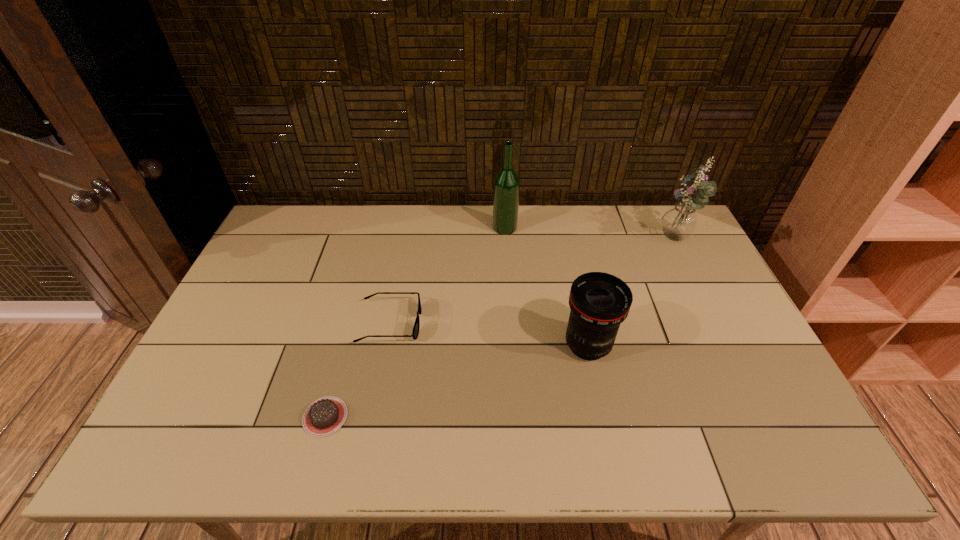
Find the location of a particular element. The image size is (960, 540). free region at the near edge of the desktop is located at coordinates (705, 447).

Find the location of a particular element. Image resolution: width=960 pixels, height=540 pixels. vacant space at the right edge is located at coordinates (687, 296).

Find the location of a particular element. free location at the far left corner of the desktop is located at coordinates click(297, 237).

You are a GUI agent. You are given a task and a screenshot of the screen. Output one action in this format:
    pyautogui.click(x=<x>, y=<y>)
    Task: Click on the free location at the far right corner of the desktop
    The height and width of the screenshot is (540, 960).
    Given the screenshot: What is the action you would take?
    pyautogui.click(x=658, y=241)

At what (x,y) coordinates should I click in order to perform the action: click on free area in between the telephoto lens and the shortest object. Please return your answer as a coordinate pair (x, y). The height and width of the screenshot is (540, 960). Looking at the image, I should click on (456, 381).

Where is `empty space that is in between the rightmost object and the spectacles`? The image size is (960, 540). empty space that is in between the rightmost object and the spectacles is located at coordinates (533, 282).

I want to click on free spot between the third object from left to right and the telephoto lens, so click(x=546, y=286).

At what (x,y) coordinates should I click in order to perform the action: click on empty space that is in between the bouquet and the fourth tallest object. Please return your answer as a coordinate pair (x, y). Looking at the image, I should click on (533, 282).

Locate an element on the screen. unoccupied position between the bouquet and the second shortest object is located at coordinates (533, 282).

Find the location of `unoccupied area between the alcohol and the fourth object from left to right`. unoccupied area between the alcohol and the fourth object from left to right is located at coordinates (546, 286).